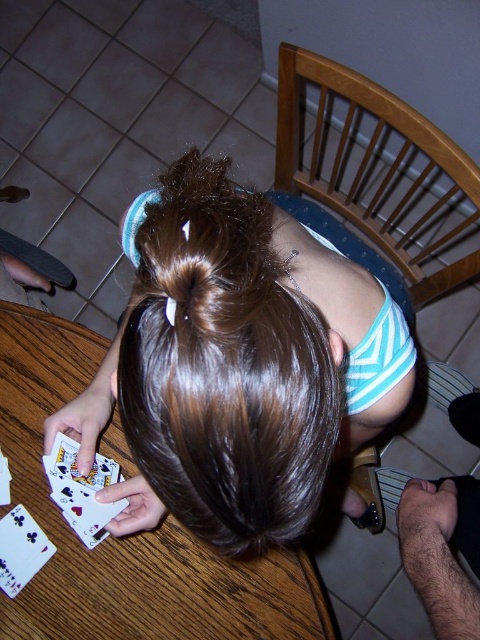
Question: Is brown shiny hair at center below wooden table at center?

Choices:
 (A) no
 (B) yes

Answer: (A)

Question: Can you confirm if brown shiny hair at center is wider than wooden table at center?

Choices:
 (A) no
 (B) yes

Answer: (A)

Question: Which of the following is the farthest from the observer?

Choices:
 (A) (135, 540)
 (B) (272, 426)

Answer: (A)

Question: Is brown shiny hair at center bigger than wooden table at center?

Choices:
 (A) no
 (B) yes

Answer: (B)